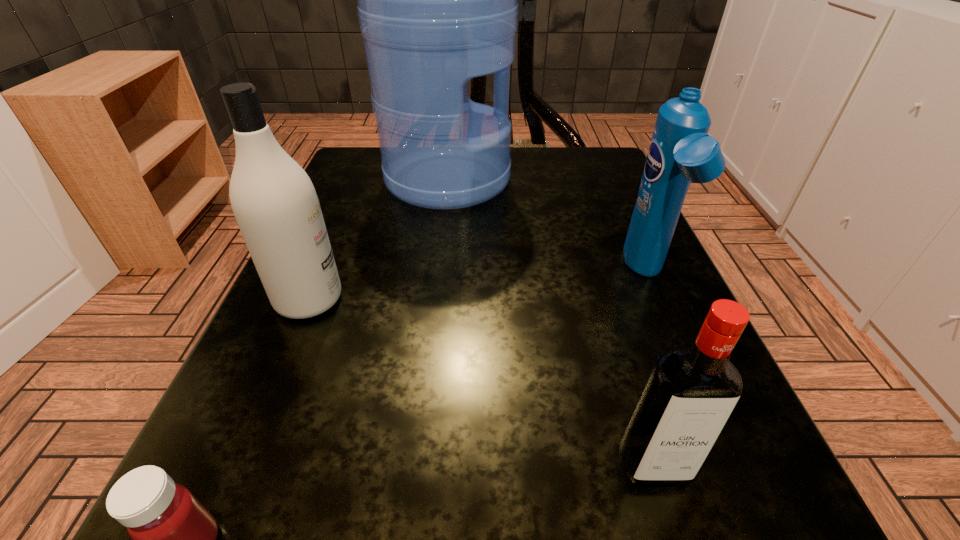
Where is `object situated at the near edge`? object situated at the near edge is located at coordinates (690, 393).

At what (x,y) coordinates should I click in order to perform the action: click on water jug located in the left edge section of the desktop. Please return your answer as a coordinate pair (x, y). The image size is (960, 540). Looking at the image, I should click on (437, 0).

Find the location of a particular element. This screenshot has height=540, width=960. shampoo at the left edge is located at coordinates (274, 201).

You are a GUI agent. You are given a task and a screenshot of the screen. Output one action in this format:
    pyautogui.click(x=<x>, y=<y>)
    Task: Click on the shampoo located at the right edge
    The width and height of the screenshot is (960, 540).
    Given the screenshot: What is the action you would take?
    681,151

The height and width of the screenshot is (540, 960). I want to click on vodka present at the right edge, so click(690, 393).

Locate an element on the screen. The image size is (960, 540). object positioned at the far left corner is located at coordinates click(437, 0).

The image size is (960, 540). Find the location of `object that is positioned at the near right corner`. object that is positioned at the near right corner is located at coordinates coord(690,393).

The height and width of the screenshot is (540, 960). I want to click on vacant region at the far edge of the desktop, so click(x=538, y=175).

Find the location of `vacant position at the near edge of the desktop`. vacant position at the near edge of the desktop is located at coordinates (579, 482).

This screenshot has width=960, height=540. Find the location of `vacant region at the left edge of the desktop`. vacant region at the left edge of the desktop is located at coordinates (396, 224).